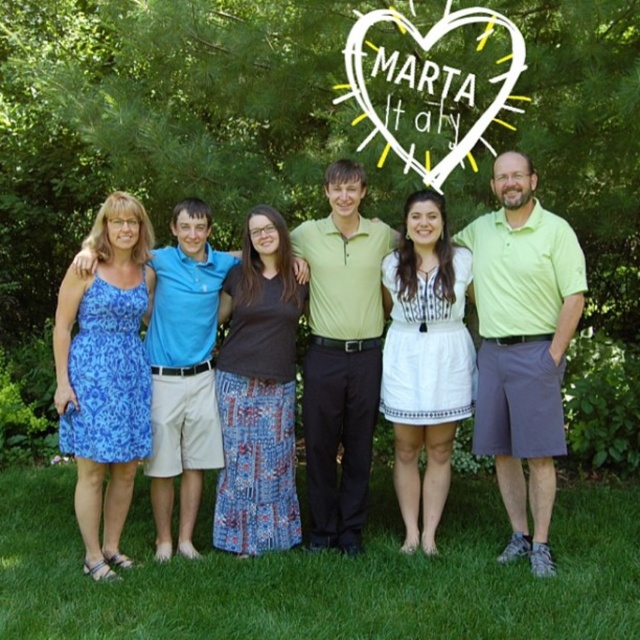
Does green grass at lower center have a lesser width compared to blue floral dress at left?

No.

This screenshot has width=640, height=640. What do you see at coordinates (324, 573) in the screenshot?
I see `green grass at lower center` at bounding box center [324, 573].

The image size is (640, 640). Find the location of `green grass at lower center`. green grass at lower center is located at coordinates (324, 573).

Measure the distance between point (372, 184) and camera.

A distance of 6.68 meters exists between point (372, 184) and camera.

In order to click on green leafy tree at center in this screenshot , I will do `click(156, 120)`.

I want to click on green leafy tree at center, so click(x=156, y=120).

Can you confirm if blue floral dress at left is positioned below white cotton dress at center?

Correct, blue floral dress at left is located below white cotton dress at center.

Between blue floral dress at left and white cotton dress at center, which one has more height?

With more height is white cotton dress at center.

The height and width of the screenshot is (640, 640). What do you see at coordinates (106, 376) in the screenshot?
I see `blue floral dress at left` at bounding box center [106, 376].

The width and height of the screenshot is (640, 640). I want to click on blue floral dress at left, so click(106, 376).